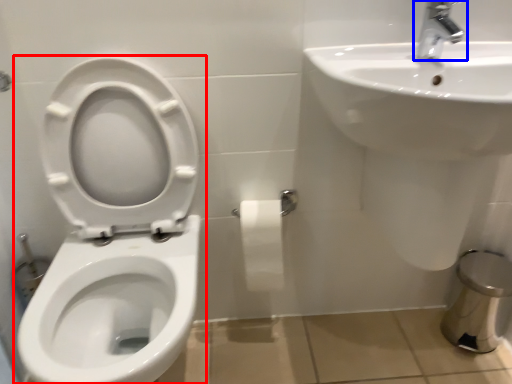
Question: Which point is further to the camera, toilet (highlighted by a red box) or tap (highlighted by a blue box)?

Choices:
 (A) toilet
 (B) tap

Answer: (B)